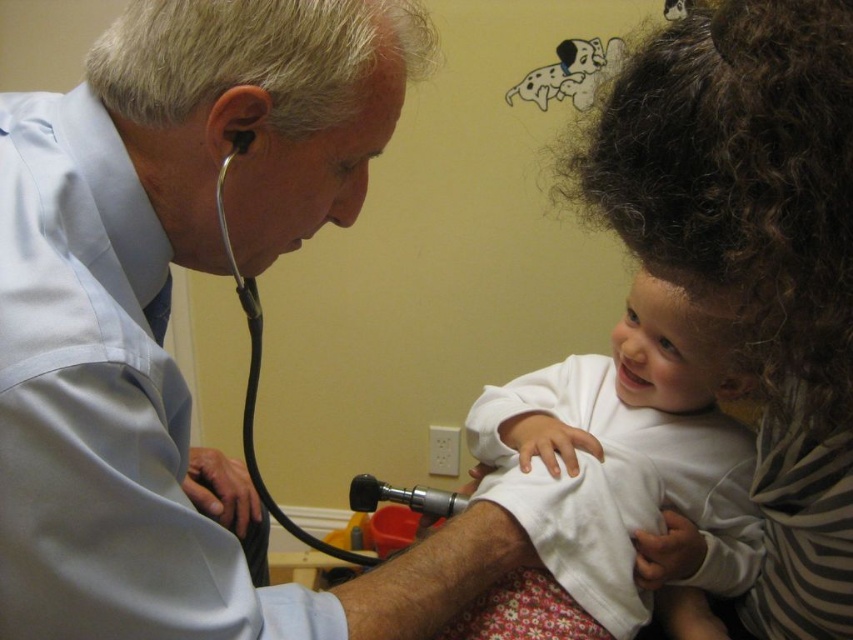
Does curly brown hair at upper right appear on the left side of metallic black stethoscope at left?

Incorrect, curly brown hair at upper right is not on the left side of metallic black stethoscope at left.

Which is behind, point (776, 412) or point (259, 332)?

Positioned behind is point (259, 332).

Measure the distance between point [665,129] and camera.

Point [665,129] and camera are 16.81 inches apart.

Where is `curly brown hair at upper right`? Image resolution: width=853 pixels, height=640 pixels. curly brown hair at upper right is located at coordinates (753, 257).

Who is positioned more to the right, curly brown hair at upper right or white soft baby at center?

From the viewer's perspective, white soft baby at center appears more on the right side.

Measure the distance between curly brown hair at upper right and camera.

curly brown hair at upper right and camera are 14.79 inches apart.

Does point (795, 586) lie behind point (630, 413)?

No, it is in front of (630, 413).

Where is `curly brown hair at upper right`? curly brown hair at upper right is located at coordinates (753, 257).

Is white soft baby at center below metallic black stethoscope at left?

No, white soft baby at center is not below metallic black stethoscope at left.

Can you confirm if white soft baby at center is thinner than metallic black stethoscope at left?

No, white soft baby at center is not thinner than metallic black stethoscope at left.

Is point (647, 429) positioned behind point (239, 144)?

Yes, it is.

Find the location of a particular element. This screenshot has width=853, height=640. white soft baby at center is located at coordinates click(x=625, y=460).